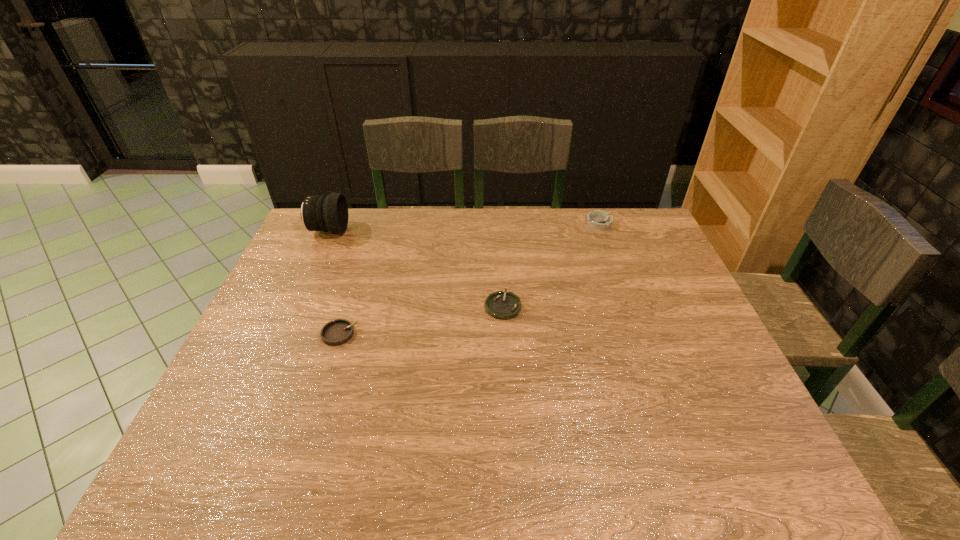
Find the location of a particular element. blank space at the left edge is located at coordinates (296, 261).

The height and width of the screenshot is (540, 960). In order to click on free space at the right edge in this screenshot , I will do `click(654, 293)`.

Where is `free space at the far left corner of the desktop`? The height and width of the screenshot is (540, 960). free space at the far left corner of the desktop is located at coordinates (350, 217).

In the image, there is a desktop. Where is `free space at the near left corner`? The height and width of the screenshot is (540, 960). free space at the near left corner is located at coordinates (244, 483).

Locate an element on the screen. The width and height of the screenshot is (960, 540). vacant region at the far right corner of the desktop is located at coordinates (647, 245).

Image resolution: width=960 pixels, height=540 pixels. I want to click on free space between the tallest object and the nearest ashtray, so click(334, 282).

Identify the location of free space that is in between the rightmost ashtray and the shortest object. (551, 265).

Locate an element on the screen. Image resolution: width=960 pixels, height=540 pixels. vacant area between the leftmost object and the shortest object is located at coordinates (416, 268).

Identify the location of vacant area that lies between the second ashtray from right to left and the second tallest object. This screenshot has width=960, height=540. click(551, 265).

Locate an element on the screen. free space between the shortest object and the rightmost object is located at coordinates (551, 265).